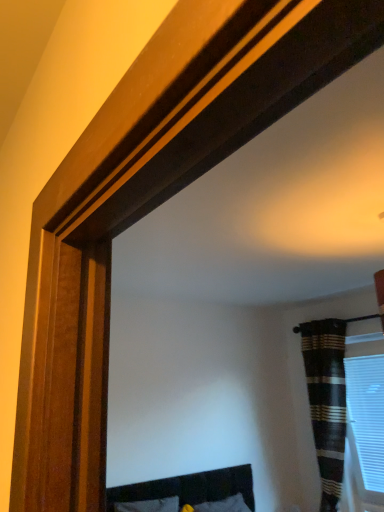
The width and height of the screenshot is (384, 512). In order to click on striped fabric curtain at right in this screenshot , I will do `click(326, 401)`.

The height and width of the screenshot is (512, 384). What do you see at coordinates (326, 401) in the screenshot? I see `striped fabric curtain at right` at bounding box center [326, 401].

Describe the element at coordinates (365, 425) in the screenshot. I see `white plastic blinds at right` at that location.

You are a GUI agent. You are given a task and a screenshot of the screen. Output one action in this format:
    pyautogui.click(x=<x>, y=<y>)
    Task: Click on the white plastic blinds at right
    
    Given the screenshot: What is the action you would take?
    pyautogui.click(x=365, y=425)

In order to click on striped fabric curtain at right in this screenshot , I will do `click(326, 401)`.

Is striped fabric curtain at right to the right of white plastic blinds at right from the viewer's perspective?

No, striped fabric curtain at right is not to the right of white plastic blinds at right.

Is striped fabric curtain at right further to the viewer compared to white plastic blinds at right?

No.

Does point (324, 329) come farther from viewer compared to point (364, 489)?

Yes, point (324, 329) is farther from viewer.

From the image's perspective, who appears lower, striped fabric curtain at right or white plastic blinds at right?

From the image's view, white plastic blinds at right is below.

From a real-world perspective, is striped fabric curtain at right located higher than white plastic blinds at right?

Correct, in the physical world, striped fabric curtain at right is higher than white plastic blinds at right.

Is striped fabric curtain at right wider or thinner than white plastic blinds at right?

Considering their sizes, striped fabric curtain at right looks broader than white plastic blinds at right.

Which of these two, striped fabric curtain at right or white plastic blinds at right, stands shorter?

white plastic blinds at right is shorter.

Considering the sizes of objects striped fabric curtain at right and white plastic blinds at right in the image provided, who is smaller, striped fabric curtain at right or white plastic blinds at right?

white plastic blinds at right.

Can we say striped fabric curtain at right lies outside white plastic blinds at right?

Yes, striped fabric curtain at right is outside of white plastic blinds at right.

Is striped fabric curtain at right not close to white plastic blinds at right?

Actually, striped fabric curtain at right and white plastic blinds at right are a little close together.

Looking at this image, is striped fabric curtain at right looking in the opposite direction of white plastic blinds at right?

That's not correct — striped fabric curtain at right is not looking away from white plastic blinds at right.

The height and width of the screenshot is (512, 384). I want to click on curtain to the left of white plastic blinds at right, so click(x=326, y=401).

Considering the relative positions of white plastic blinds at right and striped fabric curtain at right in the image provided, is white plastic blinds at right to the left of striped fabric curtain at right from the viewer's perspective?

In fact, white plastic blinds at right is to the right of striped fabric curtain at right.

Is the position of white plastic blinds at right more distant than that of striped fabric curtain at right?

Yes, white plastic blinds at right is further from the camera.

Does point (366, 500) lie behind point (335, 321)?

No, it is in front of (335, 321).

From the image's perspective, which is below, white plastic blinds at right or striped fabric curtain at right?

white plastic blinds at right appears lower in the image.

Consider the image. From a real-world perspective, is white plastic blinds at right over striped fabric curtain at right?

Actually, white plastic blinds at right is physically below striped fabric curtain at right in the real world.

Can you confirm if white plastic blinds at right is thinner than striped fabric curtain at right?

Correct, the width of white plastic blinds at right is less than that of striped fabric curtain at right.

Considering the sizes of white plastic blinds at right and striped fabric curtain at right in the image, is white plastic blinds at right taller or shorter than striped fabric curtain at right?

In the image, white plastic blinds at right appears to be shorter than striped fabric curtain at right.

Looking at the image, does white plastic blinds at right seem bigger or smaller compared to striped fabric curtain at right?

white plastic blinds at right is smaller than striped fabric curtain at right.

Is white plastic blinds at right outside of striped fabric curtain at right?

Yes.

Would you say white plastic blinds at right is a long distance from striped fabric curtain at right?

No.

Does white plastic blinds at right turn towards striped fabric curtain at right?

No, white plastic blinds at right does not turn towards striped fabric curtain at right.

How many degrees apart are the facing directions of white plastic blinds at right and striped fabric curtain at right?

The angle between the facing direction of white plastic blinds at right and the facing direction of striped fabric curtain at right is 6.62 degrees.

Consider the image. How far apart are white plastic blinds at right and striped fabric curtain at right?

The distance of white plastic blinds at right from striped fabric curtain at right is 19.33 centimeters.

Locate an element on the screen. window behind the striped fabric curtain at right is located at coordinates (365, 425).

Where is `window that appears below the striped fabric curtain at right (from the image's perspective)`? This screenshot has width=384, height=512. window that appears below the striped fabric curtain at right (from the image's perspective) is located at coordinates (365, 425).

At what (x,y) coordinates should I click in order to perform the action: click on curtain located above the white plastic blinds at right (from a real-world perspective). Please return your answer as a coordinate pair (x, y). Image resolution: width=384 pixels, height=512 pixels. Looking at the image, I should click on (326, 401).